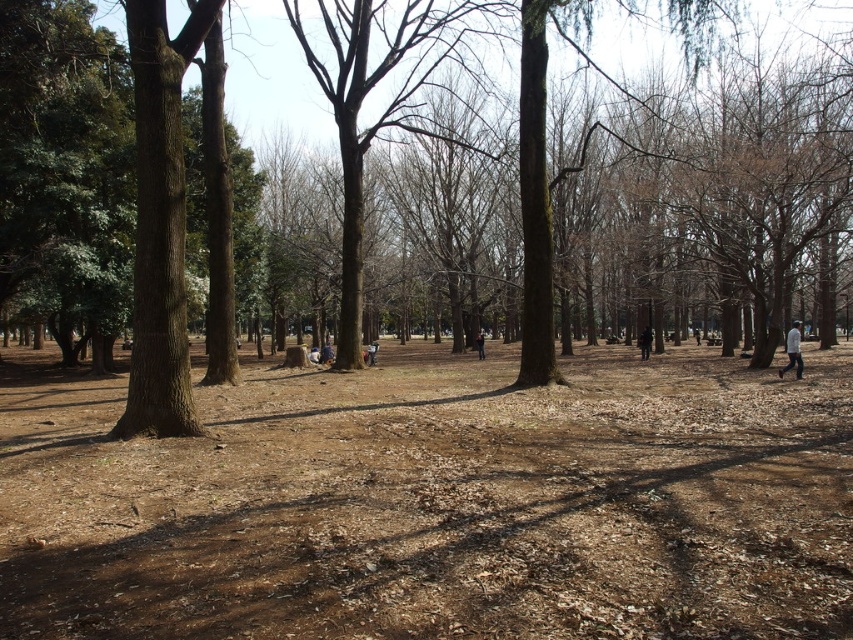
You are a person standing in the park and you see a white cotton shirt at right and a dark brown leather jacket at center. Which one is taller?

The white cotton shirt at right is much taller than the dark brown leather jacket at center.